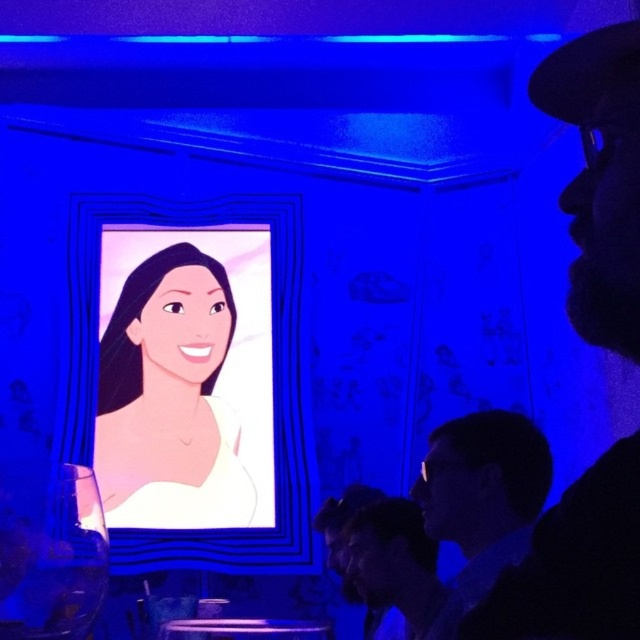
Who is positioned more to the right, matte black hat at upper right or smooth cream dress at center?

matte black hat at upper right is more to the right.

Which is behind, point (618, 538) or point (172, 474)?

Point (172, 474)

Locate an element on the screen. matte black hat at upper right is located at coordinates (600, 179).

Identify the location of matte black hat at upper right. The height and width of the screenshot is (640, 640). (600, 179).

Is smooth cream dress at center positioned in front of matte black hair at lower right?

No, smooth cream dress at center is further to the viewer.

The width and height of the screenshot is (640, 640). What are the coordinates of `smooth cream dress at center` in the screenshot? It's located at (170, 400).

Can you confirm if matte black hat at upper right is thinner than matte black hair at lower right?

Indeed, matte black hat at upper right has a lesser width compared to matte black hair at lower right.

Is matte black hat at upper right shorter than matte black hair at lower right?

In fact, matte black hat at upper right may be taller than matte black hair at lower right.

Is point (522, 627) positioned after point (433, 449)?

No, it is not.

Identify the location of matte black hat at upper right. (600, 179).